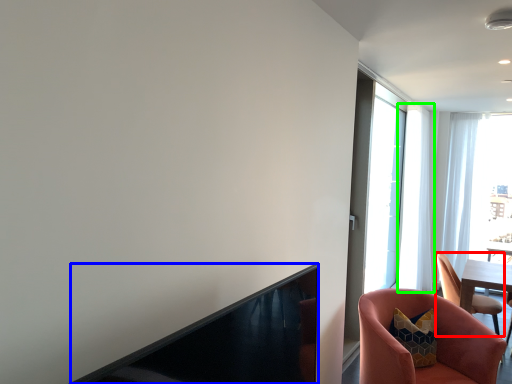
Question: Based on their relative distances, which object is farther from chair (highlighted by a red box)? Choose from fireplace (highlighted by a blue box) and curtain (highlighted by a green box).

Choices:
 (A) fireplace
 (B) curtain

Answer: (A)